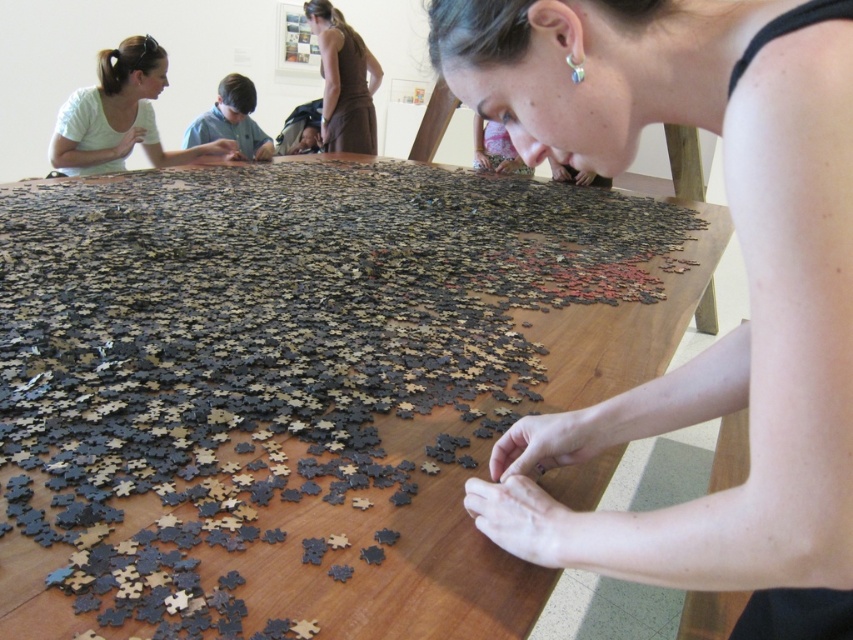
Which is below, wooden puzzle pieces at center or blue shirt at center?

Result: wooden puzzle pieces at center

Does point (345, 419) come behind point (231, 97)?

No, it is not.

Which is behind, point (454, 632) or point (224, 88)?

The point (224, 88) is more distant.

Identify the location of wooden puzzle pieces at center. (302, 387).

Is the position of matte black puzzle pieces at center more distant than that of matte white shirt at upper left?

No.

Can you confirm if matte black puzzle pieces at center is positioned to the left of matte white shirt at upper left?

In fact, matte black puzzle pieces at center is to the right of matte white shirt at upper left.

Does point (795, 84) come farther from viewer compared to point (114, 88)?

No, it is not.

The width and height of the screenshot is (853, 640). In order to click on matte black puzzle pieces at center in this screenshot , I will do `click(746, 273)`.

Is wooden puzzle pieces at center above matte white shirt at upper left?

No.

Is point (366, 164) less distant than point (119, 74)?

No, (366, 164) is behind (119, 74).

Which is in front, point (461, 536) or point (165, 68)?

Positioned in front is point (461, 536).

The width and height of the screenshot is (853, 640). I want to click on wooden puzzle pieces at center, so click(302, 387).